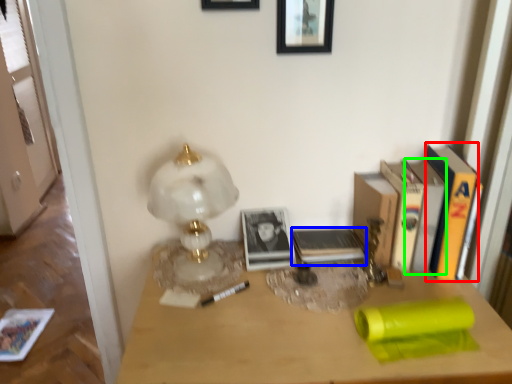
Question: Considering the real-world distances, which object is farthest from paperback book (highlighted by a red box)? paperback book (highlighted by a blue box) or paperback book (highlighted by a green box)?

Choices:
 (A) paperback book
 (B) paperback book

Answer: (A)